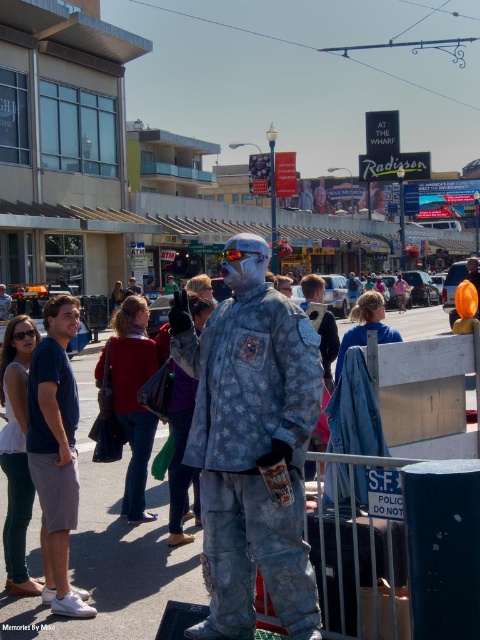
Is point (123, 44) behind point (213, 400)?

Yes, it is.

In the scene shown: Does metallic silver statue at center have a lesser width compared to camouflage fabric mannequin at center?

No, metallic silver statue at center is not thinner than camouflage fabric mannequin at center.

Does point (338, 307) come in front of point (283, 328)?

No, (338, 307) is further to viewer.

Where is `metallic silver statue at center`? This screenshot has height=640, width=480. metallic silver statue at center is located at coordinates (205, 132).

Can you confirm if camouflage fabric mannequin at center is wider than blue denim shorts at left?

Yes.

Can you confirm if camouflage fabric mannequin at center is positioned below blue denim shorts at left?

No, camouflage fabric mannequin at center is not below blue denim shorts at left.

Which is behind, point (249, 484) or point (58, 308)?

The point (58, 308) is behind.

Where is `camouflage fabric mannequin at center`? This screenshot has height=640, width=480. camouflage fabric mannequin at center is located at coordinates (251, 444).

Consider the image. Is metallic silver statue at center in front of blue denim shorts at left?

No, it is behind blue denim shorts at left.

Is point (208, 38) closer to viewer compared to point (35, 360)?

No, (208, 38) is behind (35, 360).

The image size is (480, 640). I want to click on metallic silver statue at center, so click(x=205, y=132).